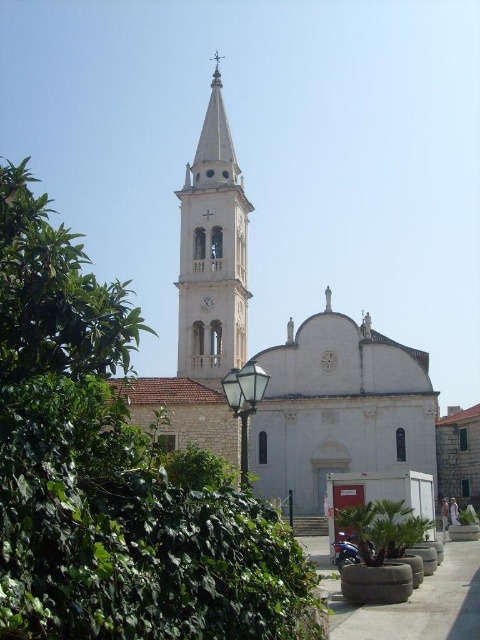
Question: Considering the real-world distances, which object is closest to the white stone church at center?

Choices:
 (A) white stone bell tower at center
 (B) green leafy tree at left

Answer: (A)

Question: Which object appears farthest from the camera in this image?

Choices:
 (A) white stone bell tower at center
 (B) white stone church at center

Answer: (A)

Question: Does white stone church at center appear on the left side of white stone bell tower at center?

Choices:
 (A) yes
 (B) no

Answer: (B)

Question: Is green leafy tree at left closer to the viewer compared to white stone bell tower at center?

Choices:
 (A) yes
 (B) no

Answer: (A)

Question: Can you confirm if green leafy tree at left is positioned to the left of white stone church at center?

Choices:
 (A) yes
 (B) no

Answer: (A)

Question: Among these objects, which one is farthest from the camera?

Choices:
 (A) white stone bell tower at center
 (B) green leafy tree at left
 (C) white stone church at center

Answer: (A)